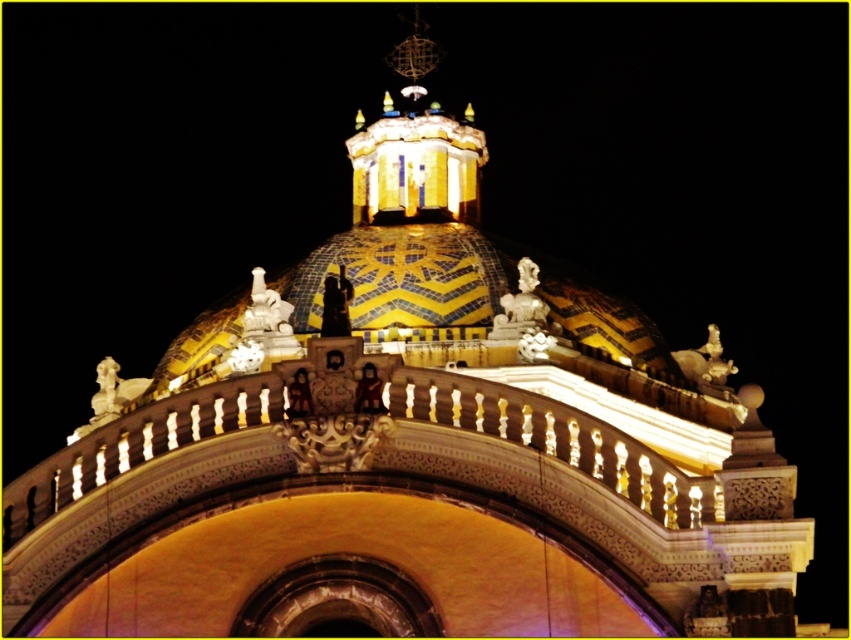
Question: Is white marble statue at upper center wider than polished bronze statue at center?

Choices:
 (A) yes
 (B) no

Answer: (B)

Question: Estimate the real-world distances between objects in this image. Which object is farther from the gold metallic statue at upper right?

Choices:
 (A) white marble statue at upper center
 (B) polished bronze statue at center

Answer: (B)

Question: Is gold metallic statue at upper right below polished bronze statue at center?

Choices:
 (A) yes
 (B) no

Answer: (A)

Question: Does gold metallic statue at upper right come behind polished bronze statue at center?

Choices:
 (A) yes
 (B) no

Answer: (A)

Question: Among these points, which one is nearest to the camera?

Choices:
 (A) (680, 349)
 (B) (330, 273)
 (C) (530, 276)

Answer: (C)

Question: Which is farther from the white marble statue at upper center?

Choices:
 (A) gold metallic statue at upper right
 (B) polished bronze statue at center

Answer: (A)